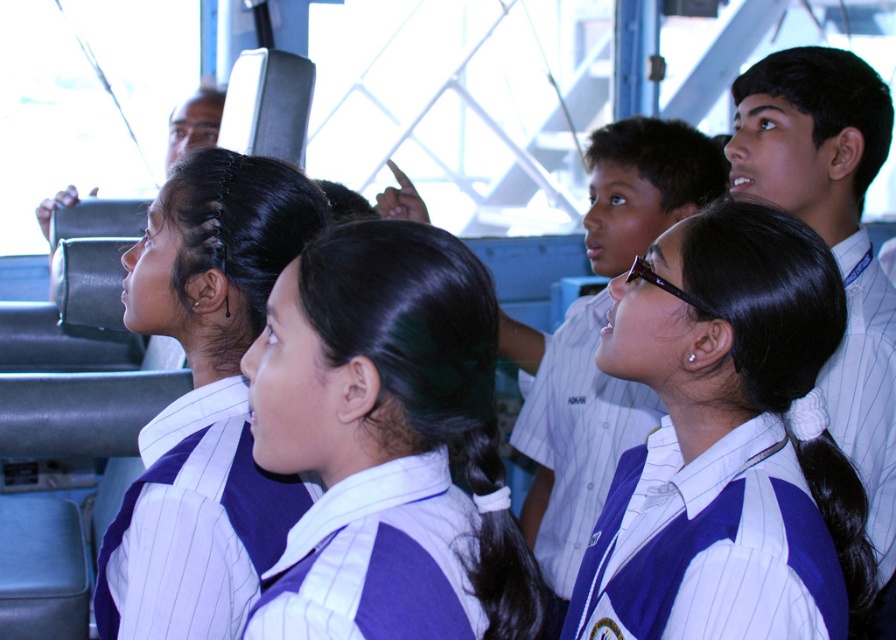
Is point (695, 618) more distant than point (537, 544)?

That is False.

Which is behind, point (773, 428) or point (530, 506)?

Positioned behind is point (530, 506).

Does point (627, 467) come in front of point (524, 426)?

Yes, it is.

Where is `blue pinstriped baseball uniform at center`? The image size is (896, 640). blue pinstriped baseball uniform at center is located at coordinates (709, 545).

Who is positioned more to the right, blue striped uniform at center or white pinstriped shirt at center?

blue striped uniform at center

Find the location of `blue striped uniform at center`. blue striped uniform at center is located at coordinates (378, 356).

Can you confirm if blue pinstriped baseball uniform at center is bigger than black silky hair at upper right?

Indeed, blue pinstriped baseball uniform at center has a larger size compared to black silky hair at upper right.

The image size is (896, 640). What do you see at coordinates (709, 545) in the screenshot?
I see `blue pinstriped baseball uniform at center` at bounding box center [709, 545].

This screenshot has width=896, height=640. In order to click on blue pinstriped baseball uniform at center in this screenshot , I will do `click(709, 545)`.

Find the location of `blue pinstriped baseball uniform at center`. blue pinstriped baseball uniform at center is located at coordinates (709, 545).